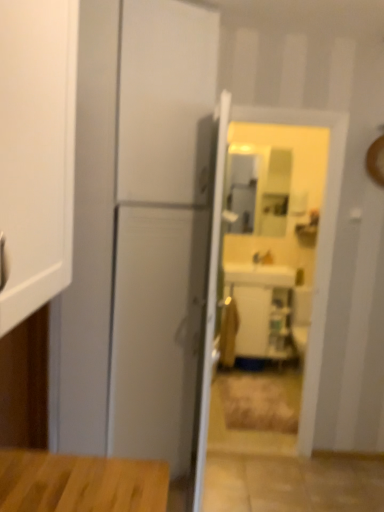
Question: From a real-world perspective, is matte brown cabinet at center beneath white glossy door at center?

Choices:
 (A) yes
 (B) no

Answer: (A)

Question: Can you confirm if matte brown cabinet at center is thinner than white glossy door at center?

Choices:
 (A) yes
 (B) no

Answer: (B)

Question: Is there a large distance between matte brown cabinet at center and white glossy door at center?

Choices:
 (A) no
 (B) yes

Answer: (B)

Question: Is matte brown cabinet at center closer to camera compared to white glossy door at center?

Choices:
 (A) yes
 (B) no

Answer: (B)

Question: From a real-world perspective, does matte brown cabinet at center stand above white glossy door at center?

Choices:
 (A) yes
 (B) no

Answer: (B)

Question: Does matte brown cabinet at center turn towards white glossy door at center?

Choices:
 (A) yes
 (B) no

Answer: (A)

Question: Does matte silver faucet at center lie in front of white glossy sink at center?

Choices:
 (A) yes
 (B) no

Answer: (B)

Question: Is matte silver faucet at center shorter than white glossy sink at center?

Choices:
 (A) yes
 (B) no

Answer: (A)

Question: Does matte silver faucet at center have a lesser width compared to white glossy sink at center?

Choices:
 (A) yes
 (B) no

Answer: (A)

Question: Considering the relative sizes of matte silver faucet at center and white glossy sink at center in the image provided, is matte silver faucet at center bigger than white glossy sink at center?

Choices:
 (A) no
 (B) yes

Answer: (A)

Question: Is matte silver faucet at center aimed at white glossy sink at center?

Choices:
 (A) no
 (B) yes

Answer: (B)

Question: Is matte silver faucet at center to the right of white glossy sink at center from the viewer's perspective?

Choices:
 (A) yes
 (B) no

Answer: (A)

Question: Can you confirm if white glossy sink at center is positioned to the left of white glossy door at center?

Choices:
 (A) yes
 (B) no

Answer: (B)